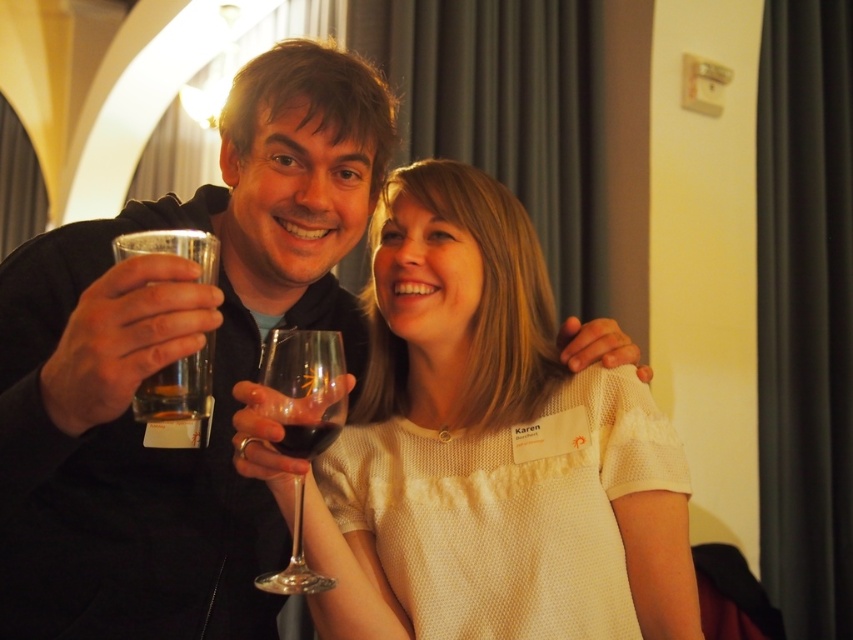
Question: Which object appears closest to the camera in this image?

Choices:
 (A) transparent glass at center
 (B) clear glass at upper left
 (C) black matte glass at upper center

Answer: (C)

Question: Is black matte glass at upper center positioned in front of clear glass at upper left?

Choices:
 (A) yes
 (B) no

Answer: (A)

Question: Can you confirm if transparent glass at center is wider than clear glass at upper left?

Choices:
 (A) yes
 (B) no

Answer: (A)

Question: Considering the real-world distances, which object is closest to the white textured shirt at center?

Choices:
 (A) translucent glass at center
 (B) black matte glass at upper center
 (C) transparent glass at center
 (D) clear glass at upper left

Answer: (B)

Question: Among these points, which one is farthest from the camera?

Choices:
 (A) [x=355, y=124]
 (B) [x=281, y=570]
 (C) [x=498, y=381]

Answer: (C)

Question: Is black matte glass at upper center smaller than translucent glass at center?

Choices:
 (A) no
 (B) yes

Answer: (A)